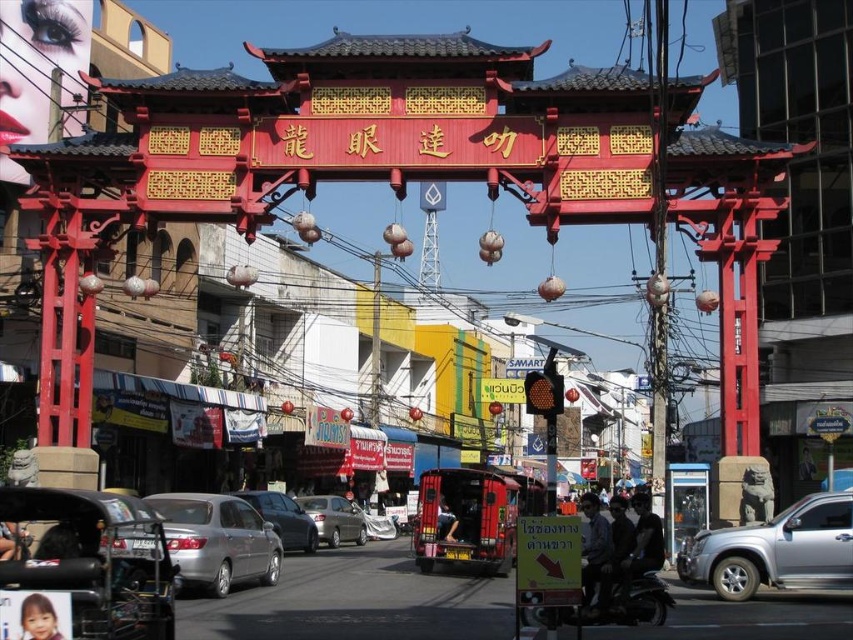
You are a delivery person needing to park your 2.5 meter wide vehicle between the satin silver sedan at center and the metallic silver motorcycle at center. Is there enough space?

The satin silver sedan at center and the metallic silver motorcycle at center are 19.72 meters apart. Since the required space for parking is only 2.5 meters, there is more than enough space between them to park the vehicle.

You are a delivery person who needs to load a package onto the roof of the satin silver sedan at center. The package is 1.8 meters tall. Considering the height of the metallic silver motorcycle at center parked nearby, can you safely lift the package onto the sedan without hitting the motorcycle?

The satin silver sedan at center is taller than the metallic silver motorcycle at center. Since the sedan is taller, the 1.8 meter package can be safely placed on its roof without hitting the motorcycle.

You are standing at the archway and want to reach the point marked as point (595, 616). There is an obstacle at point (712, 566). Will you encounter the obstacle before reaching your destination?

Yes, you will encounter the obstacle at point (712, 566) before reaching point (595, 616) because point (712, 566) is behind point (595, 616).